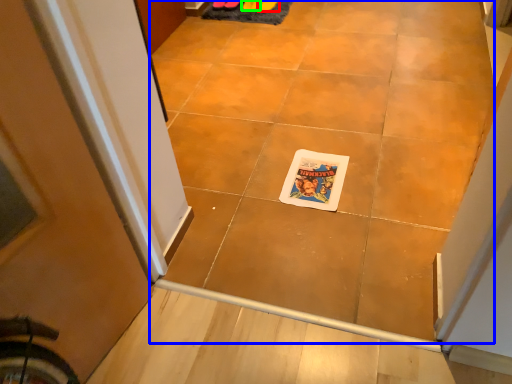
Question: Which object is the farthest from footwear (highlighted by a red box)? Choose among these: ceramic tile (highlighted by a blue box) or footwear (highlighted by a green box).

Choices:
 (A) ceramic tile
 (B) footwear

Answer: (A)